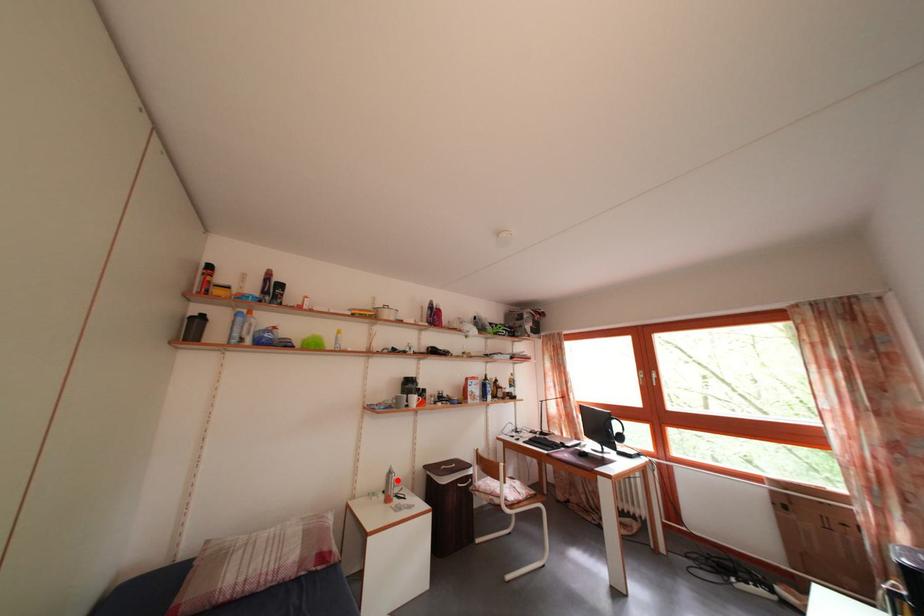
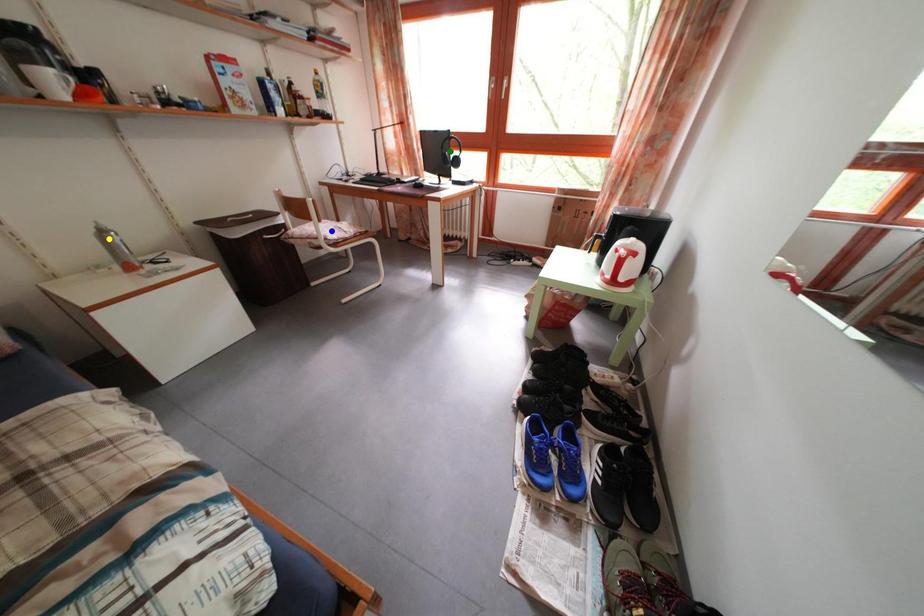
Question: I am providing you with two images of the same scene from different viewpoints. A red point is marked on the first image. You are given multiple points on the second image. Which spot in image 2 lines up with the point in image 1?

Choices:
 (A) green point
 (B) yellow point
 (C) blue point

Answer: (B)